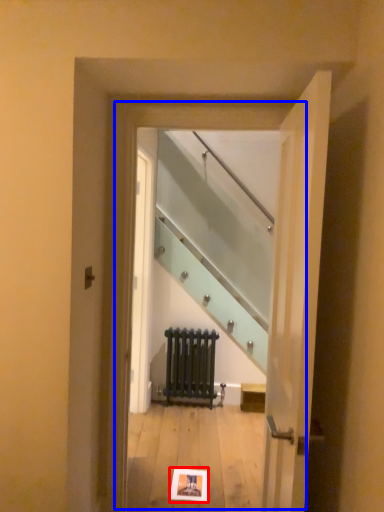
Question: Among these objects, which one is nearest to the camera, postcard (highlighted by a red box) or glass door (highlighted by a blue box)?

Choices:
 (A) postcard
 (B) glass door

Answer: (B)